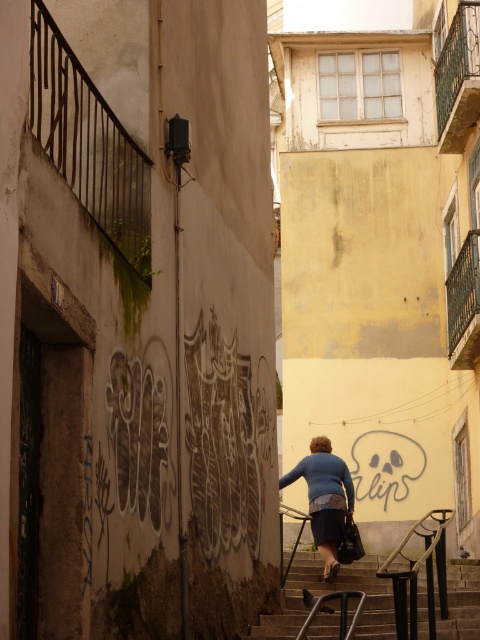
You are a delivery person trying to reach the blue sweater at center in the alleyway. The stone textured stairs at center are blocking your path. Can you go around them to reach the person?

The stone textured stairs at center is in front of blue sweater at center, so you cannot go around them to reach the person because the stairs are directly blocking the path between you and the blue sweater at center.

You are a delivery person carrying a box and need to walk up the stairs. The box is 1.5 meters long. Can you safely carry the box up the stone textured stairs at center while also passing by the blue sweater at center?

The distance between the stone textured stairs at center and blue sweater at center is 4.11 meters. Since the box is 1.5 meters long, the delivery person has enough space to maneuver the box safely as there is sufficient clearance between the two objects.

You are standing in the narrow urban alleyway between two buildings. You see a point at coordinates (326, 593). What object is located at that point?

The point at coordinates (326, 593) corresponds to the stone textured stairs at center.